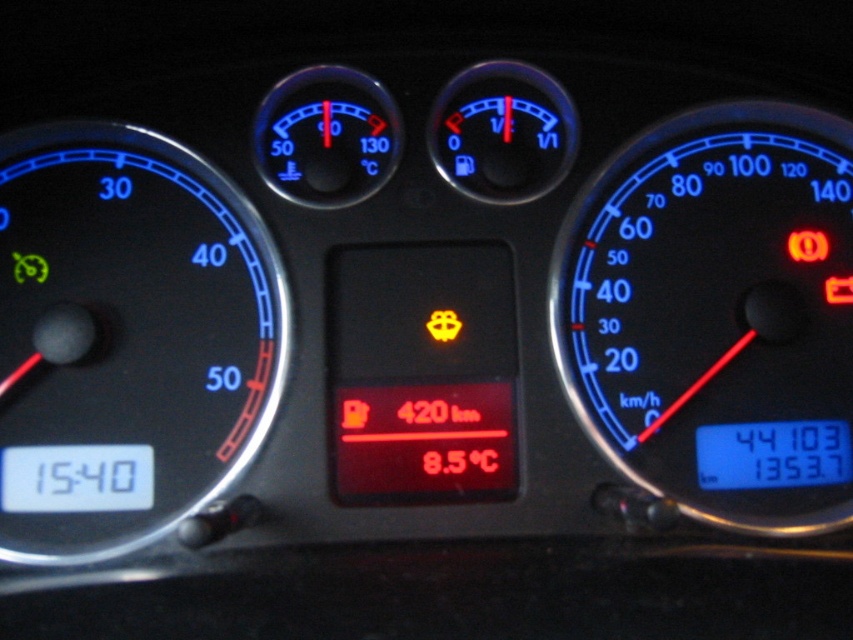
You are a GUI agent. You are given a task and a screenshot of the screen. Output one action in this format:
    pyautogui.click(x=<x>, y=<y>)
    Task: Click on the blue plastic speedometer at right
    
    Given the screenshot: What is the action you would take?
    pyautogui.click(x=717, y=314)

Does blue plastic speedometer at right have a larger size compared to black plastic speedometer at left?

No, blue plastic speedometer at right is not bigger than black plastic speedometer at left.

Locate an element on the screen. This screenshot has width=853, height=640. blue plastic speedometer at right is located at coordinates (717, 314).